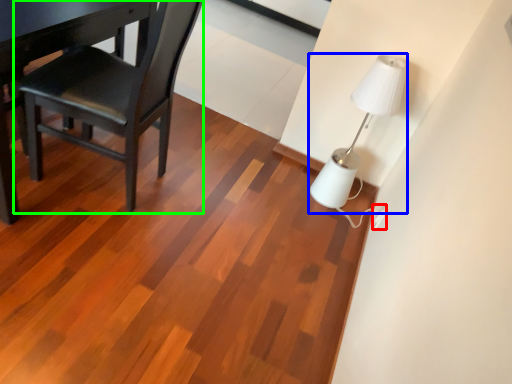
Question: Which is farther away from electric outlet (highlighted by a red box)? lamp (highlighted by a blue box) or chair (highlighted by a green box)?

Choices:
 (A) lamp
 (B) chair

Answer: (B)